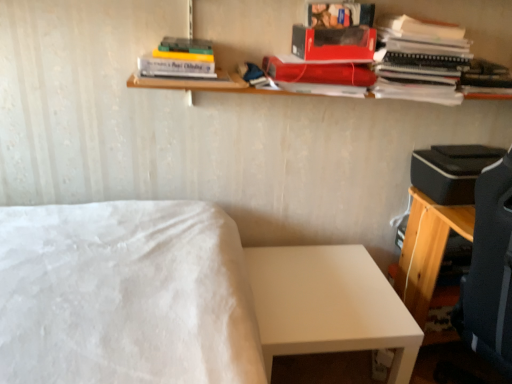
Question: Is matte red book at upper right, arranged as the 2th book when viewed from the right, thinner than wooden shelf at upper center?

Choices:
 (A) yes
 (B) no

Answer: (B)

Question: Can you confirm if matte red book at upper right, arranged as the 2th book when viewed from the right, is smaller than wooden shelf at upper center?

Choices:
 (A) no
 (B) yes

Answer: (B)

Question: From a real-world perspective, is matte red book at upper right, marked as the 2th book in a left-to-right arrangement, physically above wooden shelf at upper center?

Choices:
 (A) no
 (B) yes

Answer: (B)

Question: Is matte red book at upper right, arranged as the 2th book when viewed from the right, wider than wooden shelf at upper center?

Choices:
 (A) no
 (B) yes

Answer: (B)

Question: Does matte red book at upper right, arranged as the 2th book when viewed from the right, contain wooden shelf at upper center?

Choices:
 (A) yes
 (B) no

Answer: (B)

Question: From the image's perspective, is matte red book at upper right, arranged as the 2th book when viewed from the right, above wooden shelf at upper center?

Choices:
 (A) yes
 (B) no

Answer: (B)

Question: Does white matte bed at center come in front of hardcover book at upper center, arranged as the third book when viewed from the right?

Choices:
 (A) no
 (B) yes

Answer: (B)

Question: Is white matte bed at center oriented away from hardcover book at upper center, arranged as the third book when viewed from the right?

Choices:
 (A) no
 (B) yes

Answer: (A)

Question: Can you confirm if white matte bed at center is shorter than hardcover book at upper center, arranged as the third book when viewed from the right?

Choices:
 (A) no
 (B) yes

Answer: (A)

Question: Considering the relative positions of white matte bed at center and hardcover book at upper center, the 1th book in the left-to-right sequence, in the image provided, is white matte bed at center to the right of hardcover book at upper center, the 1th book in the left-to-right sequence, from the viewer's perspective?

Choices:
 (A) yes
 (B) no

Answer: (B)

Question: Is white matte bed at center not inside hardcover book at upper center, the 1th book in the left-to-right sequence?

Choices:
 (A) yes
 (B) no

Answer: (A)

Question: Is white matte bed at center to the left of hardcover book at upper center, arranged as the third book when viewed from the right, from the viewer's perspective?

Choices:
 (A) yes
 (B) no

Answer: (A)

Question: Can you confirm if shiny red paperback book at upper center, marked as the 2th paperback book in a bottom-to-top arrangement, is smaller than white matte bed at center?

Choices:
 (A) yes
 (B) no

Answer: (A)